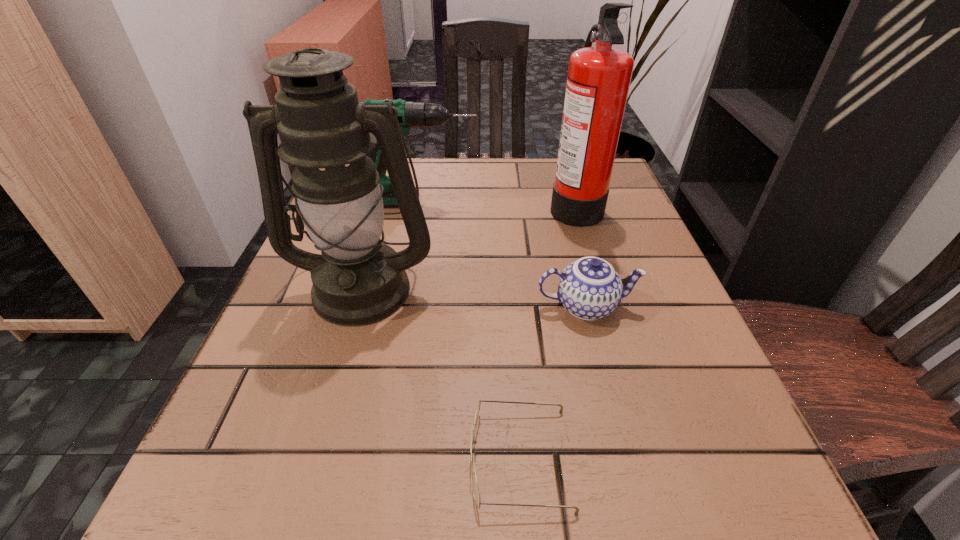
Find the location of a particular element. The image size is (960, 540). free space located 0.220m on the handle side of the drill is located at coordinates (573, 202).

Where is `free space located on the front-facing side of the nearest object`? The height and width of the screenshot is (540, 960). free space located on the front-facing side of the nearest object is located at coordinates (407, 458).

The height and width of the screenshot is (540, 960). In order to click on vacant area situated on the front-facing side of the nearest object in this screenshot , I will do `click(214, 458)`.

The width and height of the screenshot is (960, 540). In order to click on vacant space located 0.210m on the front-facing side of the nearest object in this screenshot , I will do `click(302, 458)`.

You are a GUI agent. You are given a task and a screenshot of the screen. Output one action in this format:
    pyautogui.click(x=<x>, y=<y>)
    Task: Click on the fire extinguisher positioned at the far edge
    
    Given the screenshot: What is the action you would take?
    pyautogui.click(x=599, y=77)

This screenshot has width=960, height=540. In order to click on drill that is at the far edge in this screenshot , I will do `click(410, 114)`.

Where is `object positioned at the near edge`? object positioned at the near edge is located at coordinates (476, 493).

Locate an element on the screen. Image resolution: width=960 pixels, height=540 pixels. oil lamp that is positioned at the left edge is located at coordinates (325, 133).

Find the location of a particular element. The width and height of the screenshot is (960, 540). drill present at the left edge is located at coordinates (410, 114).

In order to click on fire extinguisher located in the right edge section of the desktop in this screenshot , I will do `click(599, 77)`.